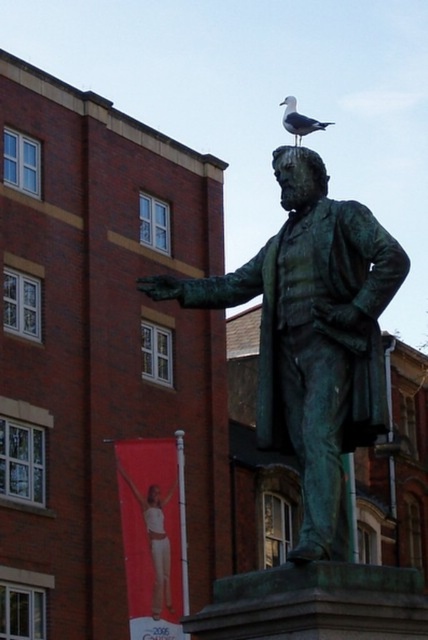
Question: Does green patina statue at center have a lesser width compared to white feathered bird at statue top?

Choices:
 (A) no
 (B) yes

Answer: (A)

Question: Is green patina statue at center below white feathered bird at statue top?

Choices:
 (A) no
 (B) yes

Answer: (B)

Question: Which point is closer to the camera?

Choices:
 (A) green patina statue at center
 (B) white feathered bird at statue top

Answer: (A)

Question: Is green patina statue at center positioned behind white feathered bird at statue top?

Choices:
 (A) yes
 (B) no

Answer: (B)

Question: Which object appears closest to the camera in this image?

Choices:
 (A) green patina statue at center
 (B) white feathered bird at statue top

Answer: (A)